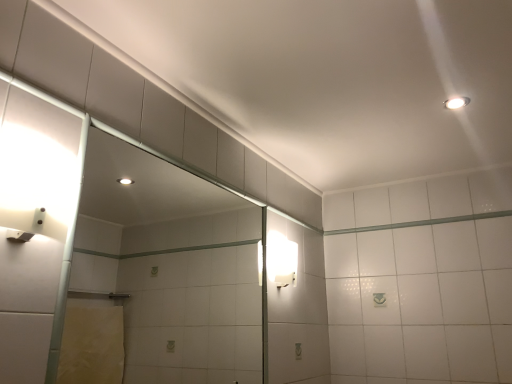
Question: Is white frosted glass sconce at right, which is the second light fixture from front to back, behind white glossy light fixture at upper right, the first light fixture from the top?

Choices:
 (A) yes
 (B) no

Answer: (A)

Question: Is white frosted glass sconce at right, the 2th light fixture positioned from the top, oriented away from white glossy light fixture at upper right, the first light fixture from the top?

Choices:
 (A) yes
 (B) no

Answer: (B)

Question: Does white frosted glass sconce at right, the 2th light fixture positioned from the top, have a lesser width compared to white glossy light fixture at upper right, which appears as the second light fixture when viewed from the back?

Choices:
 (A) no
 (B) yes

Answer: (B)

Question: From the image's perspective, is white frosted glass sconce at right, the 2th light fixture positioned from the top, above white glossy light fixture at upper right, the 2th light fixture positioned from the bottom?

Choices:
 (A) yes
 (B) no

Answer: (B)

Question: Does white frosted glass sconce at right, the 1th light fixture when ordered from left to right, have a greater height compared to white glossy light fixture at upper right, which is the first light fixture from front to back?

Choices:
 (A) yes
 (B) no

Answer: (A)

Question: From a real-world perspective, is white frosted glass sconce at right, which is the second light fixture from front to back, on white glossy light fixture at upper right, placed as the first light fixture when sorted from right to left?

Choices:
 (A) yes
 (B) no

Answer: (B)

Question: Does white glossy light fixture at upper right, which appears as the second light fixture when viewed from the back, have a larger size compared to clear glass door at left?

Choices:
 (A) no
 (B) yes

Answer: (A)

Question: Is white glossy light fixture at upper right, which appears as the second light fixture when viewed from the back, oriented towards clear glass door at left?

Choices:
 (A) yes
 (B) no

Answer: (B)

Question: Does white glossy light fixture at upper right, the first light fixture from the top, have a lesser width compared to clear glass door at left?

Choices:
 (A) no
 (B) yes

Answer: (A)

Question: Considering the relative sizes of white glossy light fixture at upper right, which appears as the second light fixture when viewed from the back, and clear glass door at left in the image provided, is white glossy light fixture at upper right, which appears as the second light fixture when viewed from the back, smaller than clear glass door at left?

Choices:
 (A) yes
 (B) no

Answer: (A)

Question: Is white glossy light fixture at upper right, which is the first light fixture from front to back, to the right of clear glass door at left from the viewer's perspective?

Choices:
 (A) no
 (B) yes

Answer: (B)

Question: Is white glossy light fixture at upper right, which appears as the second light fixture when viewed from the back, facing away from clear glass door at left?

Choices:
 (A) no
 (B) yes

Answer: (A)

Question: Does clear glass door at left lie behind white frosted glass sconce at right, arranged as the 1th light fixture when viewed from the back?

Choices:
 (A) yes
 (B) no

Answer: (B)